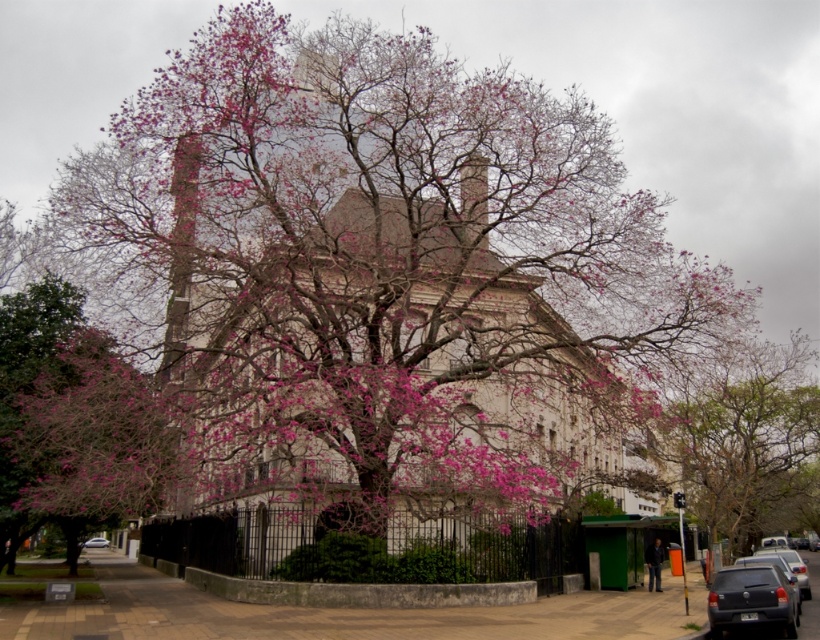
Looking at this image, you are a photographer planning to take a picture of the smooth beige church at center and the matte gray sedan at lower right. Considering their sizes, which object should you focus on to ensure both are clearly visible in the frame?

The smooth beige church at center is bigger than the matte gray sedan at lower right, so focusing on the church will ensure both are clearly visible in the frame as the church takes up more space.

You are a photographer planning to take a photo of the historic building. You want to ensure the pink bloom tree at center and the white glossy car at center are both visible in the frame. Given their sizes, which object might require you to adjust your camera angle to fit both into the composition?

The pink bloom tree at center is larger in size than the white glossy car at center, so you may need to adjust your camera angle to accommodate the larger size of the pink bloom tree at center to ensure both are fully visible in the frame.